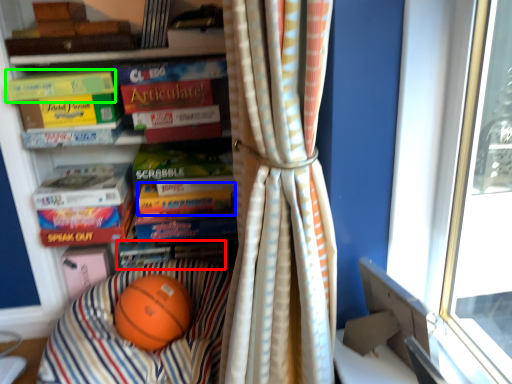
Question: Which is farther away from book (highlighted by a red box)? paperback book (highlighted by a blue box) or paperback book (highlighted by a green box)?

Choices:
 (A) paperback book
 (B) paperback book

Answer: (B)